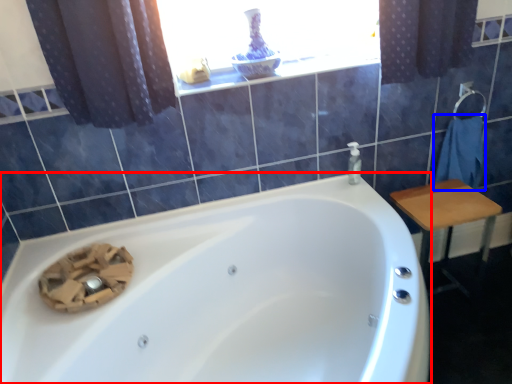
Question: Which object appears farthest to the camera in this image, bathtub (highlighted by a red box) or bath towel (highlighted by a blue box)?

Choices:
 (A) bathtub
 (B) bath towel

Answer: (B)